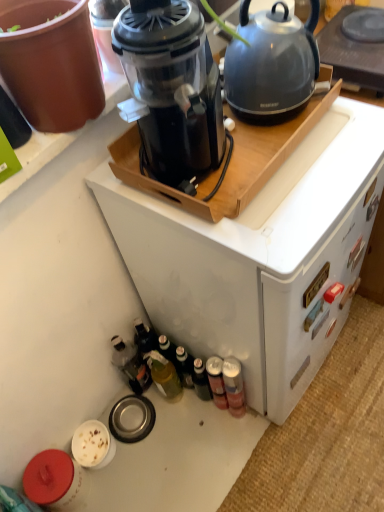
You are a GUI agent. You are given a task and a screenshot of the screen. Output one action in this format:
    pyautogui.click(x=<x>, y=<y>)
    Task: Click on the space that is in front of translucent glass bottle at lower center, which is the 3th bottle from right to left
    This screenshot has height=512, width=384.
    Given the screenshot: What is the action you would take?
    pyautogui.click(x=182, y=444)